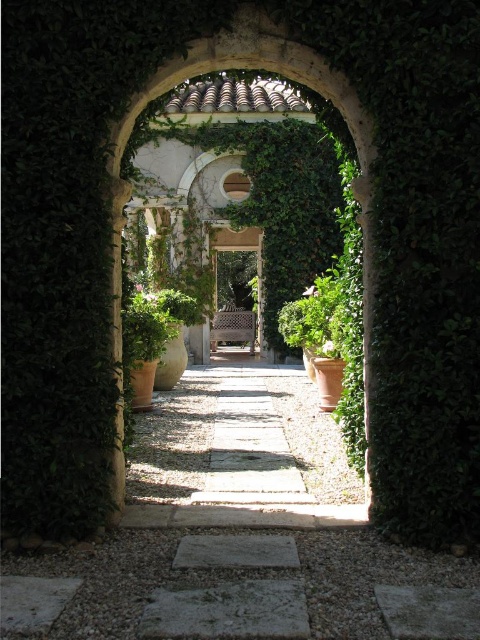
Is smooth stone path at center to the left of wooden bench at center from the viewer's perspective?

No, smooth stone path at center is not to the left of wooden bench at center.

The image size is (480, 640). Describe the element at coordinates (250, 449) in the screenshot. I see `smooth stone path at center` at that location.

Between point (232, 440) and point (261, 257), which one is positioned in front?

Point (232, 440) is in front.

The image size is (480, 640). What are the coordinates of `smooth stone path at center` in the screenshot? It's located at (250, 449).